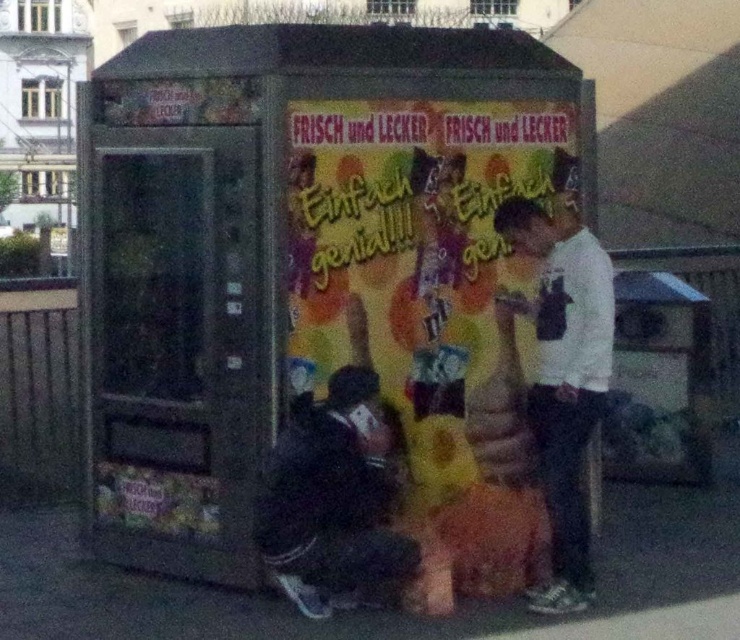
Is point (87, 321) positioned before point (403, 538)?

No.

Between point (514, 408) and point (262, 516), which one is positioned in front?

Point (262, 516) is more forward.

You are a GUI agent. You are given a task and a screenshot of the screen. Output one action in this format:
    pyautogui.click(x=<x>, y=<y>)
    Task: Click on the metallic gray vending machine at center
    This screenshot has width=740, height=640.
    Given the screenshot: What is the action you would take?
    pyautogui.click(x=314, y=276)

Based on the photo, measure the distance between point (357,534) and camera.

Point (357,534) is 4.56 meters from camera.

The image size is (740, 640). Describe the element at coordinates (333, 502) in the screenshot. I see `black fabric squat at lower center` at that location.

I want to click on black fabric squat at lower center, so pos(333,502).

Between point (511, 292) and point (551, 433), which one is positioned behind?

Point (511, 292)

Is metallic gray vending machine at center to the right of white matte shirt at center from the viewer's perspective?

Incorrect, metallic gray vending machine at center is not on the right side of white matte shirt at center.

You are a GUI agent. You are given a task and a screenshot of the screen. Output one action in this format:
    pyautogui.click(x=<x>, y=<y>)
    Task: Click on the metallic gray vending machine at center
    Image resolution: width=740 pixels, height=640 pixels.
    Given the screenshot: What is the action you would take?
    pyautogui.click(x=314, y=276)